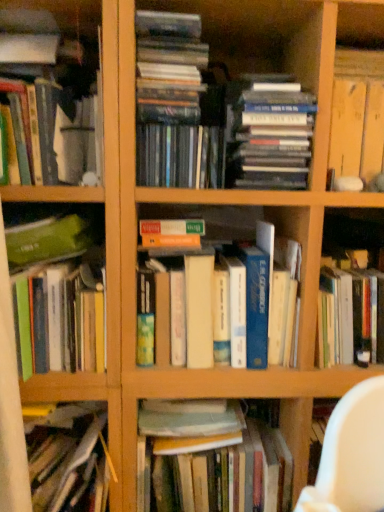
Question: From their relative heights in the image, would you say hardcover book at upper right, the third book from the top, is taller or shorter than matte white vase at upper left, the fourth book from the top?

Choices:
 (A) tall
 (B) short

Answer: (A)

Question: Does point (344, 108) appear closer or farther from the camera than point (82, 108)?

Choices:
 (A) closer
 (B) farther

Answer: (A)

Question: Estimate the real-world distances between objects in this image. Which object is farther from the hardcover book at lower left, arranged as the second book when ordered from the bottom?

Choices:
 (A) green matte book at left, the third book ordered from the bottom
 (B) hardcover books at center, the first book when ordered from top to bottom
 (C) hardcover book at bottom center, which is counted as the 10th book, starting from the top
 (D) matte white vase at upper left, the fourth book from the top
 (E) hardcover book at upper right, the eighth book positioned from the bottom

Answer: (E)

Question: Which object is positioned closest to the hardcover books at center, arranged as the fifth book when viewed from the top?

Choices:
 (A) hardcover book at bottom center, placed as the 1th book when sorted from bottom to top
 (B) hardcover books at center, the 7th book in the top-to-bottom sequence
 (C) hardcover book at upper center, which is the ninth book from bottom to top
 (D) hardcover books at center, the first book when ordered from top to bottom
 (E) hardcover book at upper right, the eighth book positioned from the bottom

Answer: (D)